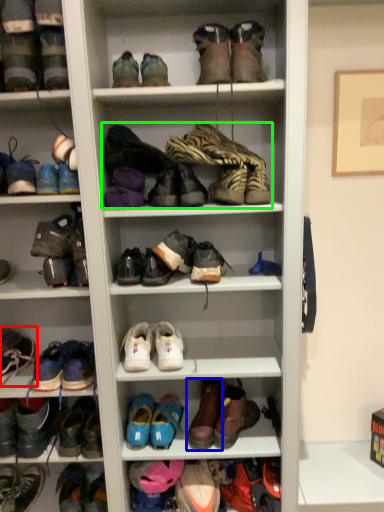
Question: Which object is the farthest from footwear (highlighted by a red box)? Choose among these: shoe (highlighted by a blue box) or footwear (highlighted by a green box).

Choices:
 (A) shoe
 (B) footwear

Answer: (B)